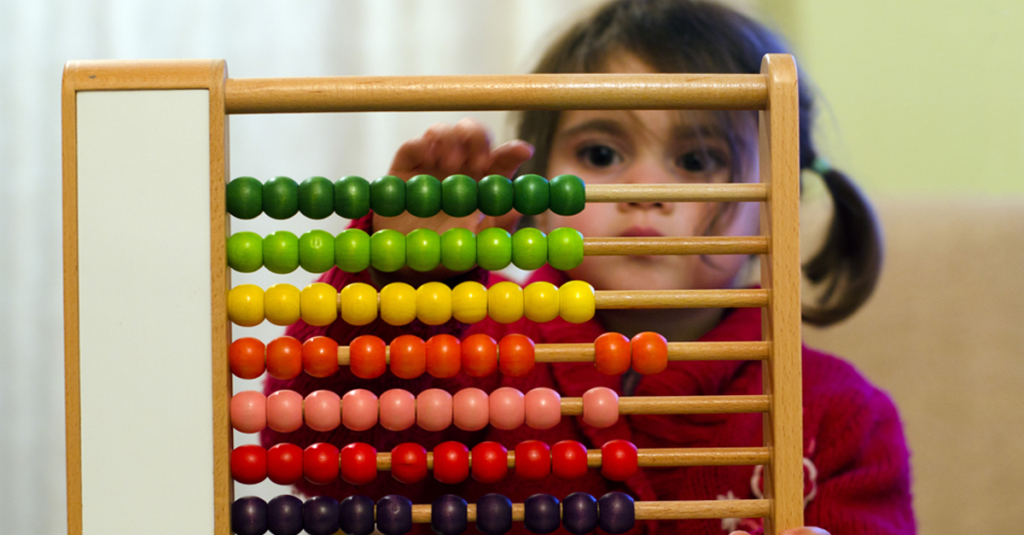
At what (x,y) coordinates should I click in order to perform the action: click on wooden rods. Please return your answer as a coordinate pair (x, y). The width and height of the screenshot is (1024, 535). Looking at the image, I should click on (725, 188), (719, 240), (723, 296), (712, 347), (721, 401), (728, 454), (727, 507), (636, 89).